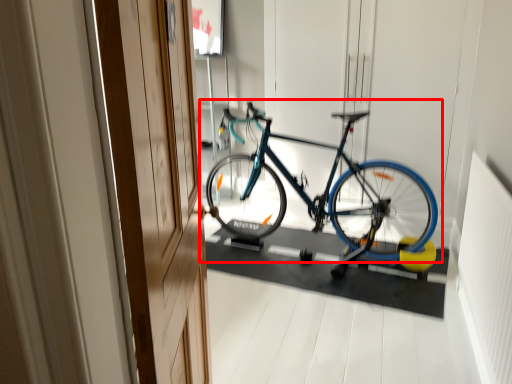
Question: Observing the image, what is the correct spatial positioning of bicycle (annotated by the red box) in reference to door?

Choices:
 (A) left
 (B) right

Answer: (B)